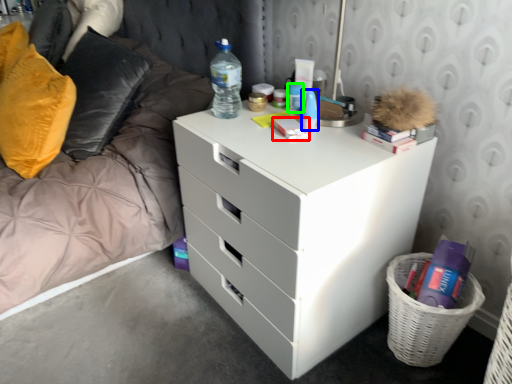
Question: Estimate the real-world distances between objects in this image. Which object is farther from book (highlighted by a red box), toiletry (highlighted by a blue box) or toiletry (highlighted by a green box)?

Choices:
 (A) toiletry
 (B) toiletry

Answer: (B)